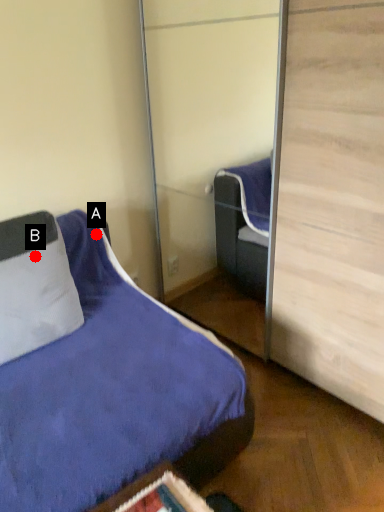
Question: Two points are circled on the image, labeled by A and B beside each circle. Which point is closer to the camera?

Choices:
 (A) A is closer
 (B) B is closer

Answer: (B)